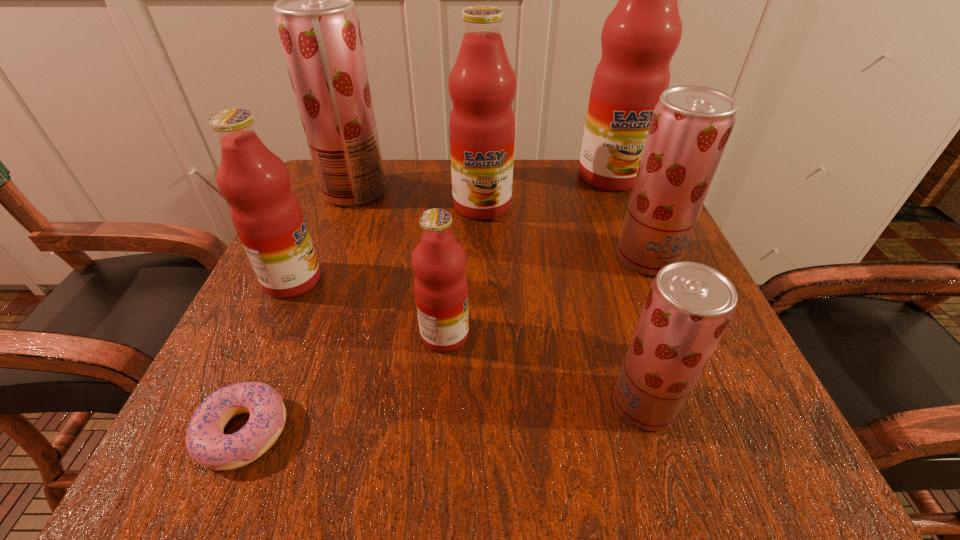
The height and width of the screenshot is (540, 960). In the image, there is a desktop. Identify the location of vacant space at the near edge. (422, 451).

In order to click on vacant space at the left edge of the desktop in this screenshot , I will do [330, 301].

At what (x,y) coordinates should I click in order to perform the action: click on vacant position at the right edge of the desktop. Please return your answer as a coordinate pair (x, y). The height and width of the screenshot is (540, 960). Looking at the image, I should click on (609, 268).

Identify the location of free space at the far left corner of the desktop. The width and height of the screenshot is (960, 540). (347, 211).

At what (x,y) coordinates should I click in order to perform the action: click on vacant area that lies between the leftmost pink fruit juice and the tallest fruit juice. Please return your answer as a coordinate pair (x, y). Image resolution: width=960 pixels, height=540 pixels. Looking at the image, I should click on (451, 228).

Locate an element on the screen. This screenshot has width=960, height=540. free area in between the second smallest pink fruit juice and the tallest object is located at coordinates (451, 228).

Identify the location of empty space that is in between the second smallest strawberry fruit juice and the farthest strawberry fruit juice. The height and width of the screenshot is (540, 960). (501, 225).

Find the location of `free space between the farthest strawberry fruit juice and the second smallest strawberry fruit juice`. free space between the farthest strawberry fruit juice and the second smallest strawberry fruit juice is located at coordinates (501, 225).

The width and height of the screenshot is (960, 540). Find the location of `vacant point located between the biggest strawberry fruit juice and the pink doughnut`. vacant point located between the biggest strawberry fruit juice and the pink doughnut is located at coordinates (299, 312).

Find the location of `vacant area between the smallest pink fruit juice and the third biggest pink fruit juice`. vacant area between the smallest pink fruit juice and the third biggest pink fruit juice is located at coordinates (369, 307).